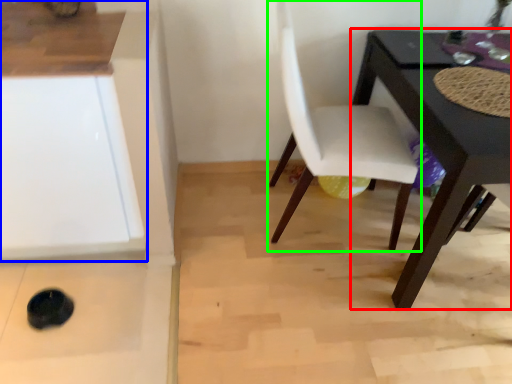
Question: Which object is the farthest from table (highlighted by a red box)? Choose among these: cabinetry (highlighted by a blue box) or chair (highlighted by a green box).

Choices:
 (A) cabinetry
 (B) chair

Answer: (A)